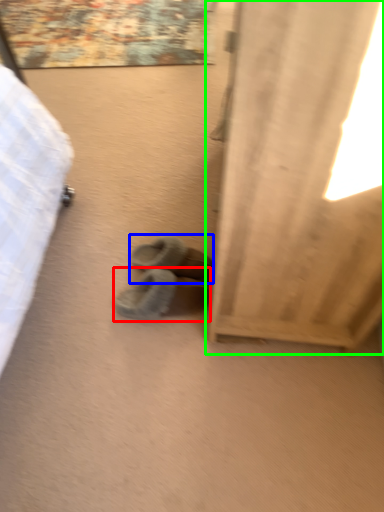
Question: Which object is the farthest from footwear (highlighted by a red box)? Choose among these: footwear (highlighted by a blue box) or curtain (highlighted by a green box).

Choices:
 (A) footwear
 (B) curtain

Answer: (B)